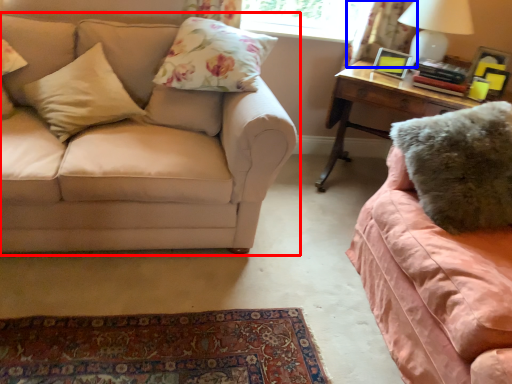
Question: Which object appears farthest to the camera in this image, studio couch (highlighted by a red box) or curtain (highlighted by a blue box)?

Choices:
 (A) studio couch
 (B) curtain

Answer: (B)